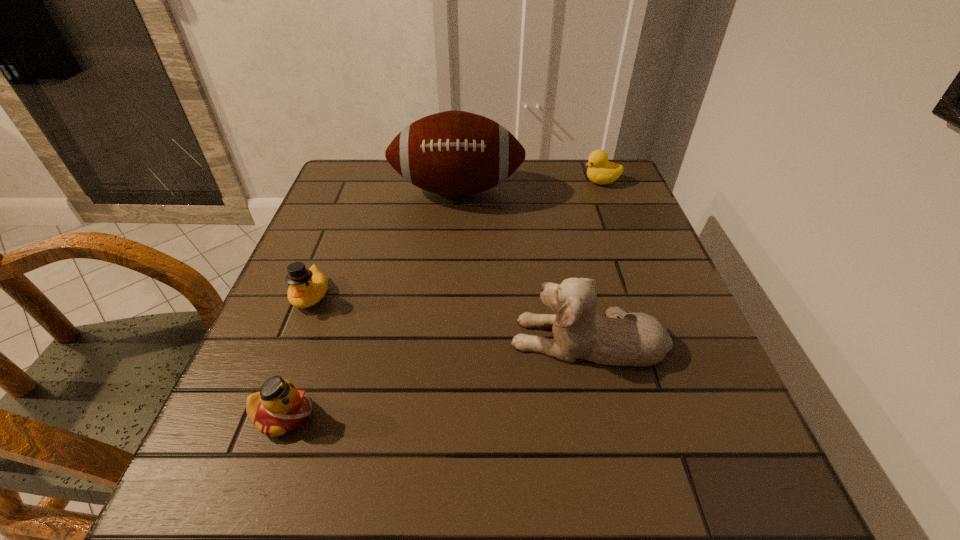
Identify the location of football. The width and height of the screenshot is (960, 540). (454, 153).

I want to click on puppy, so click(x=620, y=339).

Find the location of `the second nearest duck`. the second nearest duck is located at coordinates (307, 287).

You are a GUI agent. You are given a task and a screenshot of the screen. Output one action in this format:
    pyautogui.click(x=<x>, y=<y>)
    Task: Click on the rightmost duck
    The width and height of the screenshot is (960, 540).
    Given the screenshot: What is the action you would take?
    pyautogui.click(x=601, y=171)

Where is `the nearest object`? The width and height of the screenshot is (960, 540). the nearest object is located at coordinates (280, 407).

Where is `free space located on the laces of the tallest object`? This screenshot has height=540, width=960. free space located on the laces of the tallest object is located at coordinates (451, 269).

Where is `vacant space situated 0.050m on the front-facing side of the puppy`? The width and height of the screenshot is (960, 540). vacant space situated 0.050m on the front-facing side of the puppy is located at coordinates (483, 339).

The width and height of the screenshot is (960, 540). In order to click on vacant space positioned 0.340m on the front-facing side of the puppy in this screenshot , I will do `click(326, 339)`.

Identify the location of free space located 0.170m on the front-facing side of the puppy. (419, 339).

This screenshot has height=540, width=960. Find the location of `vacant region located 0.160m on the front-facing side of the second nearest duck`. vacant region located 0.160m on the front-facing side of the second nearest duck is located at coordinates (275, 387).